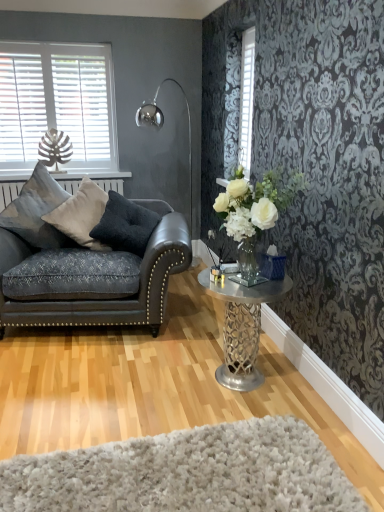
At what (x,y) coordinates should I click in order to perform the action: click on vacant space situated on the left part of metallic silver table at center. Please return your answer as a coordinate pair (x, y). Image resolution: width=384 pixels, height=512 pixels. Looking at the image, I should click on (163, 378).